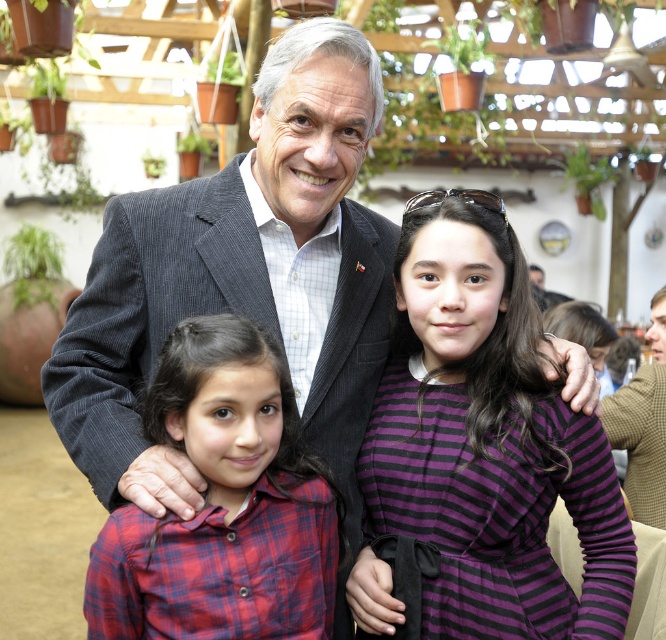
Question: Considering the real-world distances, which object is closest to the dark gray corduroy suit at center?

Choices:
 (A) plaid fabric shirt at lower left
 (B) purple striped dress at center

Answer: (A)

Question: Based on their relative distances, which object is nearer to the purple striped dress at center?

Choices:
 (A) dark gray corduroy suit at center
 (B) plaid fabric shirt at lower left

Answer: (A)

Question: Which object is positioned farthest from the dark gray corduroy suit at center?

Choices:
 (A) purple striped dress at center
 (B) plaid fabric shirt at lower left

Answer: (A)

Question: In this image, where is dark gray corduroy suit at center located relative to purple striped dress at center?

Choices:
 (A) left
 (B) right

Answer: (A)

Question: Does purple striped dress at center have a greater width compared to plaid fabric shirt at lower left?

Choices:
 (A) no
 (B) yes

Answer: (B)

Question: Can you confirm if dark gray corduroy suit at center is wider than plaid fabric shirt at lower left?

Choices:
 (A) no
 (B) yes

Answer: (B)